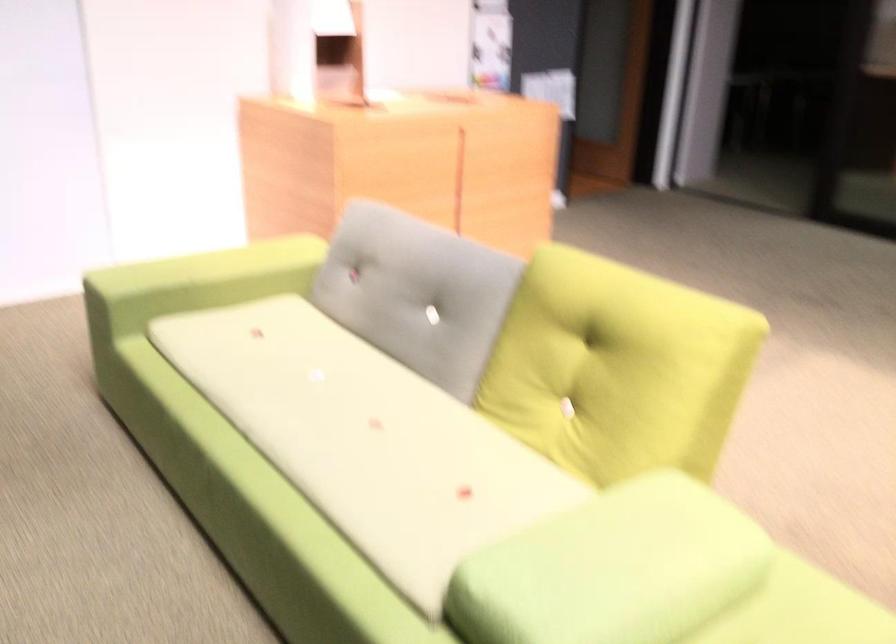
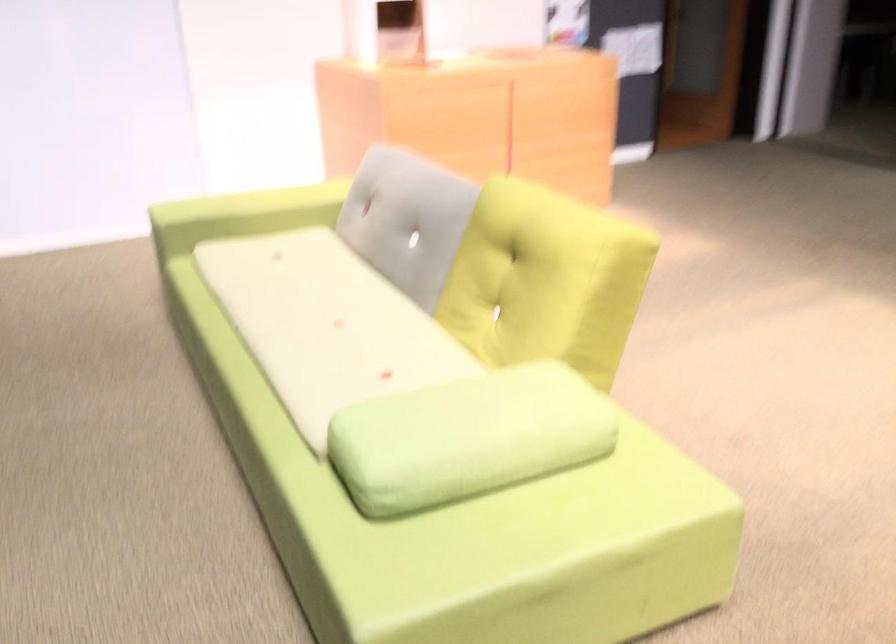
Question: In a continuous first-person perspective shot, in which direction is the camera moving?

Choices:
 (A) Left
 (B) Right
 (C) Forward
 (D) Backward

Answer: (B)